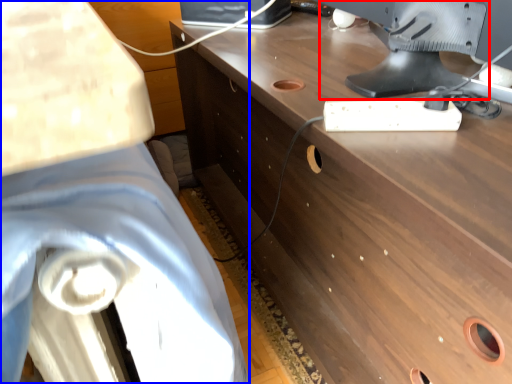
Question: Which point is closer to the camera, computer monitor (highlighted by a red box) or swivel chair (highlighted by a blue box)?

Choices:
 (A) computer monitor
 (B) swivel chair

Answer: (B)